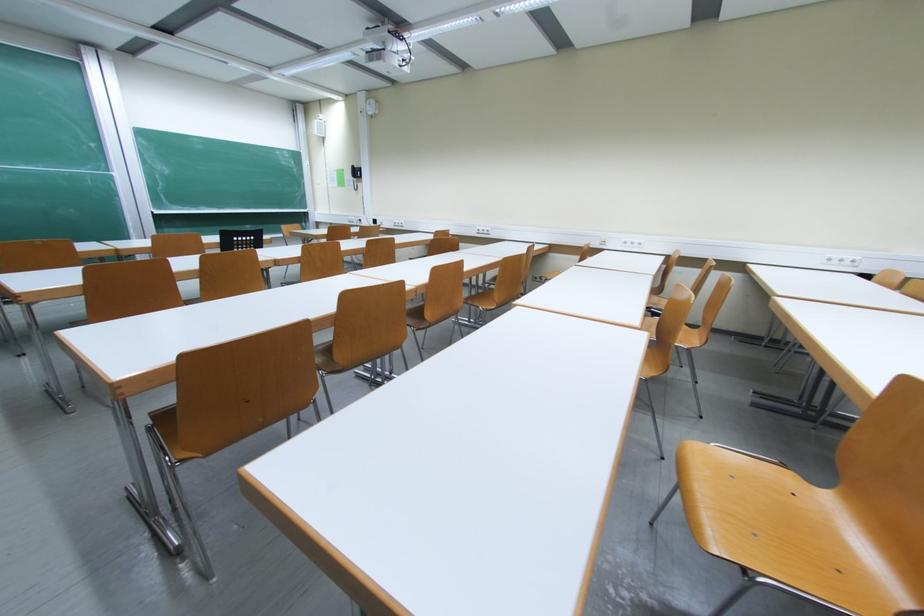
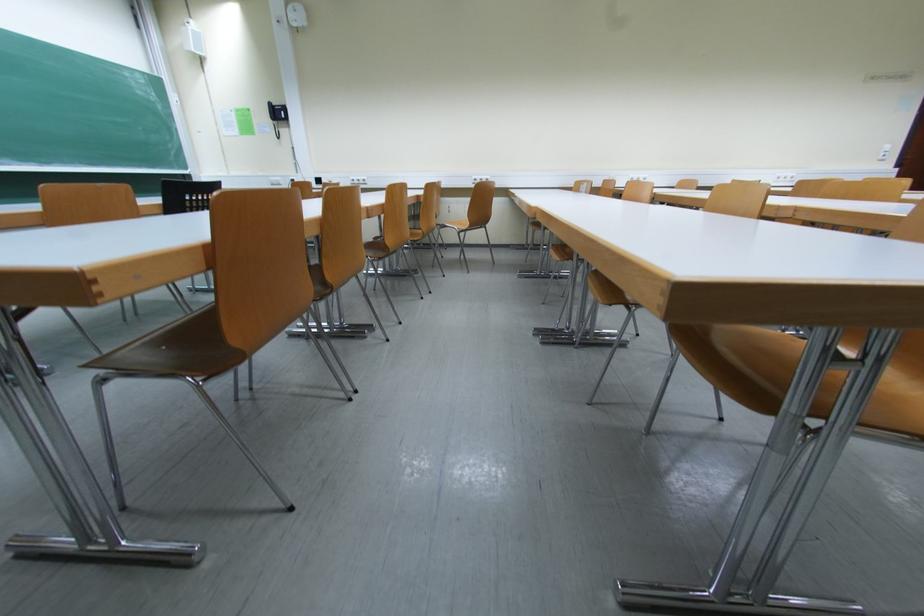
The images are taken continuously from a first-person perspective. In which direction are you moving?

The cameraman moved toward left, forward.